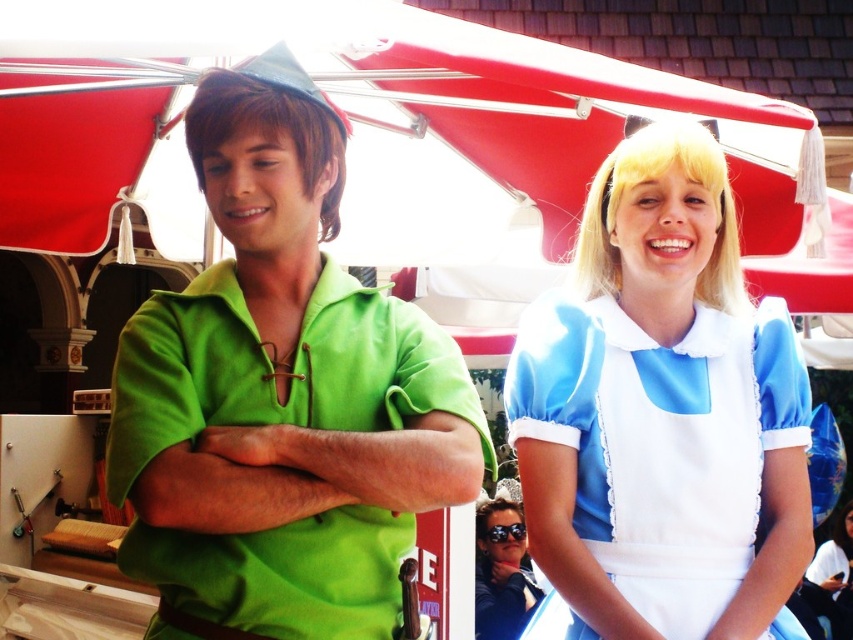
Question: Can you confirm if matte blue dress at center is positioned below blue satin dress at right?

Choices:
 (A) yes
 (B) no

Answer: (B)

Question: Can you confirm if blue satin dress at right is smaller than sunglasses at center?

Choices:
 (A) no
 (B) yes

Answer: (A)

Question: Among these points, which one is farthest from the camera?

Choices:
 (A) (157, 452)
 (B) (524, 604)
 (C) (368, 198)
 (D) (606, 248)

Answer: (B)

Question: Can you confirm if matte blue dress at center is wider than blue satin dress at right?

Choices:
 (A) yes
 (B) no

Answer: (A)

Question: Which point is farther to the camera?

Choices:
 (A) (476, 627)
 (B) (67, 177)
 (C) (306, 241)

Answer: (A)

Question: Which point is closer to the camera?

Choices:
 (A) matte blue dress at center
 (B) blue satin dress at right

Answer: (A)